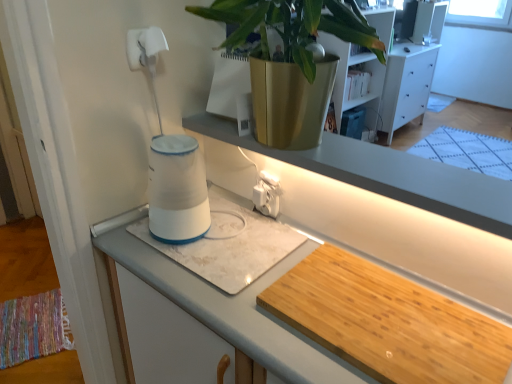
Where is `free space above white laminate cabinet at center (from a real-world perspective)`? free space above white laminate cabinet at center (from a real-world perspective) is located at coordinates (304, 277).